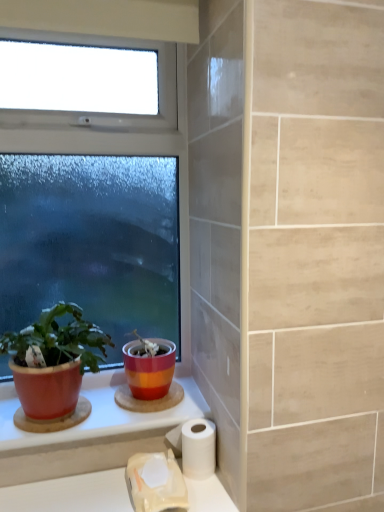
Question: Does matte red pot at left have a greater width compared to white matte toilet paper at lower center, acting as the 1th toilet paper starting from the right?

Choices:
 (A) no
 (B) yes

Answer: (B)

Question: Is matte red pot at left bigger than white matte toilet paper at lower center, arranged as the 2th toilet paper when viewed from the left?

Choices:
 (A) yes
 (B) no

Answer: (A)

Question: Does matte red pot at left have a smaller size compared to white matte toilet paper at lower center, acting as the 1th toilet paper starting from the right?

Choices:
 (A) no
 (B) yes

Answer: (A)

Question: From a real-world perspective, is matte red pot at left under white matte toilet paper at lower center, acting as the 1th toilet paper starting from the right?

Choices:
 (A) yes
 (B) no

Answer: (B)

Question: Is matte red pot at left shorter than white matte toilet paper at lower center, arranged as the 2th toilet paper when viewed from the left?

Choices:
 (A) yes
 (B) no

Answer: (B)

Question: Would you say clear glass window at upper left is to the left or to the right of matte ceramic pot at center in the picture?

Choices:
 (A) right
 (B) left

Answer: (B)

Question: Considering the positions of clear glass window at upper left and matte ceramic pot at center in the image, is clear glass window at upper left taller or shorter than matte ceramic pot at center?

Choices:
 (A) short
 (B) tall

Answer: (B)

Question: Is clear glass window at upper left inside or outside of matte ceramic pot at center?

Choices:
 (A) inside
 (B) outside

Answer: (B)

Question: Looking at the image, does clear glass window at upper left seem bigger or smaller compared to matte ceramic pot at center?

Choices:
 (A) big
 (B) small

Answer: (A)

Question: Is matte ceramic pot at center in front of or behind white matte toilet paper at lower center, arranged as the 2th toilet paper when viewed from the left, in the image?

Choices:
 (A) behind
 (B) front

Answer: (A)

Question: Is matte ceramic pot at center bigger or smaller than white matte toilet paper at lower center, arranged as the 2th toilet paper when viewed from the left?

Choices:
 (A) small
 (B) big

Answer: (B)

Question: Visually, is matte ceramic pot at center positioned to the left or to the right of white matte toilet paper at lower center, acting as the 1th toilet paper starting from the right?

Choices:
 (A) right
 (B) left

Answer: (B)

Question: Considering the positions of point (165, 365) and point (190, 419), is point (165, 365) closer or farther from the camera than point (190, 419)?

Choices:
 (A) closer
 (B) farther

Answer: (B)

Question: Considering the positions of white matte toilet paper at lower center, acting as the 2th toilet paper starting from the right, and matte ceramic counter top at lower left in the image, is white matte toilet paper at lower center, acting as the 2th toilet paper starting from the right, taller or shorter than matte ceramic counter top at lower left?

Choices:
 (A) short
 (B) tall

Answer: (B)

Question: Considering the positions of point (172, 457) and point (6, 419), is point (172, 457) closer or farther from the camera than point (6, 419)?

Choices:
 (A) closer
 (B) farther

Answer: (A)